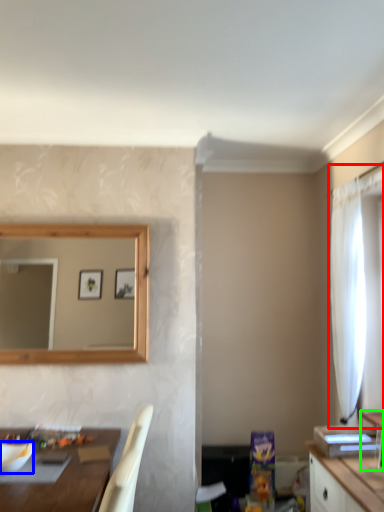
Question: Based on their relative distances, which object is nearer to curtain (highlighted by a red box)? Choose from mixing bowl (highlighted by a blue box) and vanity (highlighted by a green box).

Choices:
 (A) mixing bowl
 (B) vanity

Answer: (B)